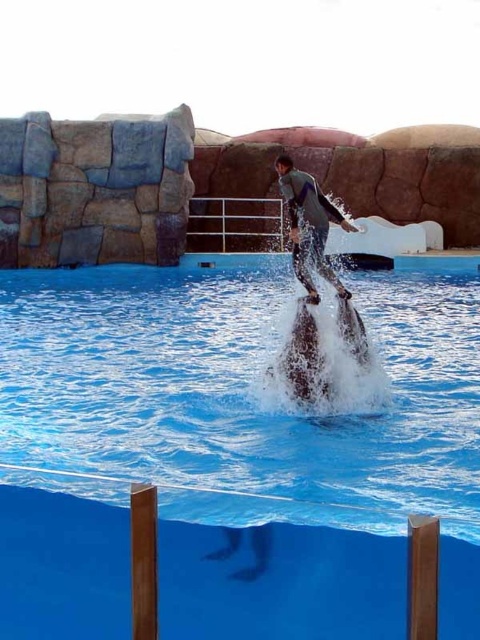
You are a safety officer at the marine park. You need to ensure that the gray matte wetsuit at center and the black glossy dolphin at center are positioned safely. Based on their current positions, which object is closer to the water surface?

The gray matte wetsuit at center is above the black glossy dolphin at center, so the gray matte wetsuit at center is closer to the water surface.

You are a photographer positioned at the edge of the pool and want to capture both the water stunt performer and the rocky structure in your shot. Which of the two points, point (304, 212) or point (362, 330), is closer to your camera lens?

Point (304, 212) is closer to the viewer than point (362, 330), so it will appear nearer in the photograph.